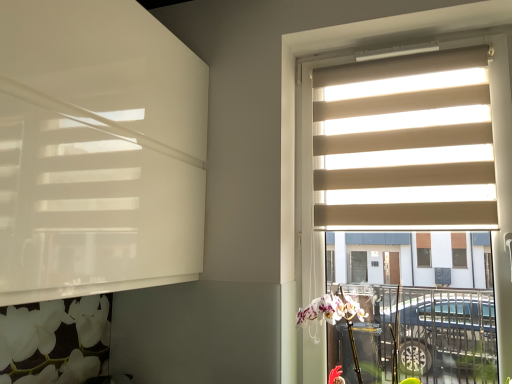
This screenshot has height=384, width=512. In order to click on beige fabric blinds at upper right in this screenshot , I will do `click(405, 144)`.

What do you see at coordinates (405, 144) in the screenshot?
I see `beige fabric blinds at upper right` at bounding box center [405, 144].

At what (x,y) coordinates should I click in order to perform the action: click on beige fabric blinds at right. Please return your answer as a coordinate pair (x, y). This screenshot has width=512, height=384. Looking at the image, I should click on (310, 123).

Describe the element at coordinates (310, 123) in the screenshot. This screenshot has height=384, width=512. I see `beige fabric blinds at right` at that location.

The width and height of the screenshot is (512, 384). What are the coordinates of `beige fabric blinds at upper right` in the screenshot? It's located at (405, 144).

Does beige fabric blinds at right appear on the right side of beige fabric blinds at upper right?

Correct, you'll find beige fabric blinds at right to the right of beige fabric blinds at upper right.

Considering their positions, is beige fabric blinds at right located in front of or behind beige fabric blinds at upper right?

Clearly, beige fabric blinds at right is in front of beige fabric blinds at upper right.

Which is in front, point (505, 172) or point (425, 212)?

The point (505, 172) is in front.

From the image's perspective, is beige fabric blinds at right below beige fabric blinds at upper right?

Yes, from the image's perspective, beige fabric blinds at right is beneath beige fabric blinds at upper right.

From a real-world perspective, who is located lower, beige fabric blinds at right or beige fabric blinds at upper right?

beige fabric blinds at right is physically lower.

Considering the sizes of objects beige fabric blinds at right and beige fabric blinds at upper right in the image provided, who is thinner, beige fabric blinds at right or beige fabric blinds at upper right?

With smaller width is beige fabric blinds at upper right.

Is beige fabric blinds at right taller than beige fabric blinds at upper right?

Yes.

Which of these two, beige fabric blinds at right or beige fabric blinds at upper right, is bigger?

beige fabric blinds at right.

Is beige fabric blinds at right located outside beige fabric blinds at upper right?

Absolutely, beige fabric blinds at right is external to beige fabric blinds at upper right.

Is beige fabric blinds at right placed right next to beige fabric blinds at upper right?

beige fabric blinds at right is not next to beige fabric blinds at upper right, and they're not touching.

Is beige fabric blinds at right oriented away from beige fabric blinds at upper right?

That's right, beige fabric blinds at right is facing away from beige fabric blinds at upper right.

Where is `window blind located above the beige fabric blinds at right (from the image's perspective)`? Image resolution: width=512 pixels, height=384 pixels. window blind located above the beige fabric blinds at right (from the image's perspective) is located at coordinates [405, 144].

Is beige fabric blinds at upper right at the right side of beige fabric blinds at right?

Incorrect, beige fabric blinds at upper right is not on the right side of beige fabric blinds at right.

Which is behind, beige fabric blinds at upper right or beige fabric blinds at right?

beige fabric blinds at upper right is further from the camera.

Is point (341, 130) positioned behind point (359, 31)?

Yes, point (341, 130) is behind point (359, 31).

From the image's perspective, is beige fabric blinds at upper right on top of beige fabric blinds at right?

Correct, beige fabric blinds at upper right appears higher than beige fabric blinds at right in the image.

From a real-world perspective, relative to beige fabric blinds at right, is beige fabric blinds at upper right vertically above or below?

beige fabric blinds at upper right is situated higher than beige fabric blinds at right in the real world.

Is beige fabric blinds at upper right thinner than beige fabric blinds at right?

Indeed, beige fabric blinds at upper right has a lesser width compared to beige fabric blinds at right.

From the picture: Is beige fabric blinds at upper right taller or shorter than beige fabric blinds at right?

Clearly, beige fabric blinds at upper right is shorter compared to beige fabric blinds at right.

Looking at the image, does beige fabric blinds at upper right seem bigger or smaller compared to beige fabric blinds at right?

Considering their sizes, beige fabric blinds at upper right takes up less space than beige fabric blinds at right.

Can we say beige fabric blinds at upper right lies outside beige fabric blinds at right?

No, beige fabric blinds at upper right is inside or overlapping with beige fabric blinds at right.

Is beige fabric blinds at upper right far away from beige fabric blinds at right?

That's not correct — beige fabric blinds at upper right is a little close to beige fabric blinds at right.

Consider the image. Does beige fabric blinds at upper right turn towards beige fabric blinds at right?

Yes.

What's the angular difference between beige fabric blinds at upper right and beige fabric blinds at right's facing directions?

1.68 degrees.

Measure the distance from beige fabric blinds at upper right to beige fabric blinds at right.

beige fabric blinds at upper right and beige fabric blinds at right are 6.01 inches apart.

Where is `window located on the right of beige fabric blinds at upper right`? The width and height of the screenshot is (512, 384). window located on the right of beige fabric blinds at upper right is located at coordinates (310, 123).

Where is `window below the beige fabric blinds at upper right (from the image's perspective)`? This screenshot has width=512, height=384. window below the beige fabric blinds at upper right (from the image's perspective) is located at coordinates (310, 123).

Identify the location of window blind behind the beige fabric blinds at right. This screenshot has height=384, width=512. (405, 144).